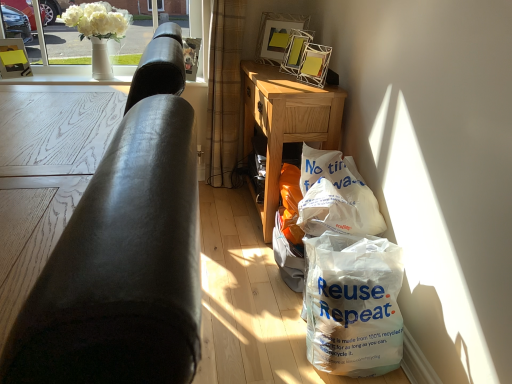
Question: Does white glossy picture frame at upper center, the second picture frame from the left, have a smaller size compared to plaid fabric curtain at center?

Choices:
 (A) no
 (B) yes

Answer: (B)

Question: From the image's perspective, is white glossy picture frame at upper center, the second picture frame from the left, located beneath plaid fabric curtain at center?

Choices:
 (A) no
 (B) yes

Answer: (A)

Question: Does white glossy picture frame at upper center, the second picture frame from the left, have a lesser height compared to plaid fabric curtain at center?

Choices:
 (A) no
 (B) yes

Answer: (B)

Question: Does white glossy picture frame at upper center, the second picture frame from the left, have a lesser width compared to plaid fabric curtain at center?

Choices:
 (A) no
 (B) yes

Answer: (B)

Question: From a real-world perspective, is white glossy picture frame at upper center, the second picture frame from the left, on top of plaid fabric curtain at center?

Choices:
 (A) no
 (B) yes

Answer: (B)

Question: Does white glossy picture frame at upper center, placed as the 2th picture frame when sorted from right to left, lie behind plaid fabric curtain at center?

Choices:
 (A) no
 (B) yes

Answer: (A)

Question: Does white ceramic vase at upper left, the 1th window screen positioned from the right, appear on the left side of matte yellow picture frame at upper left, the 3th picture frame positioned from the right?

Choices:
 (A) yes
 (B) no

Answer: (B)

Question: Can you confirm if white ceramic vase at upper left, arranged as the 2th window screen when viewed from the left, is taller than matte yellow picture frame at upper left, the 3th picture frame positioned from the right?

Choices:
 (A) yes
 (B) no

Answer: (A)

Question: From the image's perspective, is white ceramic vase at upper left, the 1th window screen positioned from the right, below matte yellow picture frame at upper left, which is counted as the first picture frame, starting from the left?

Choices:
 (A) no
 (B) yes

Answer: (A)

Question: Can you confirm if white ceramic vase at upper left, the 1th window screen positioned from the right, is thinner than matte yellow picture frame at upper left, which is counted as the first picture frame, starting from the left?

Choices:
 (A) yes
 (B) no

Answer: (B)

Question: Does white ceramic vase at upper left, the 1th window screen positioned from the right, come behind matte yellow picture frame at upper left, which is counted as the first picture frame, starting from the left?

Choices:
 (A) no
 (B) yes

Answer: (A)

Question: From the image's perspective, would you say white ceramic vase at upper left, the 1th window screen positioned from the right, is positioned over matte yellow picture frame at upper left, which is counted as the first picture frame, starting from the left?

Choices:
 (A) yes
 (B) no

Answer: (A)

Question: Is white plastic bag at lower right to the left of white ceramic vase at upper left, the 1th window screen positioned from the right, from the viewer's perspective?

Choices:
 (A) yes
 (B) no

Answer: (B)